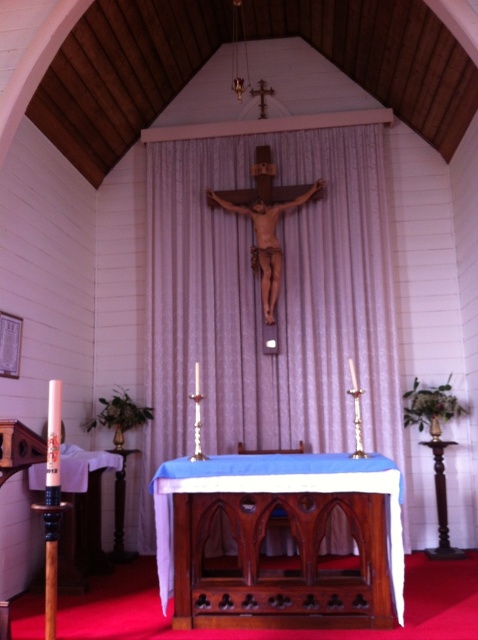
In the scene shown: You are a visitor standing at the entrance of the church and want to see both the white fabric curtain at center and the wooden altar at center. Which object will appear bigger to you?

The white fabric curtain at center will appear bigger to you because it is larger in size than the wooden altar at center.

In the scene shown: You are standing in the church and want to move from the point at coordinates point (x=199, y=324) to the point at coordinates point (x=260, y=477). Which direction should you move to get closer to your destination?

To move from point (x=199, y=324) to point (x=260, y=477), you should move forward since point (x=199, y=324) is behind point (x=260, y=477).